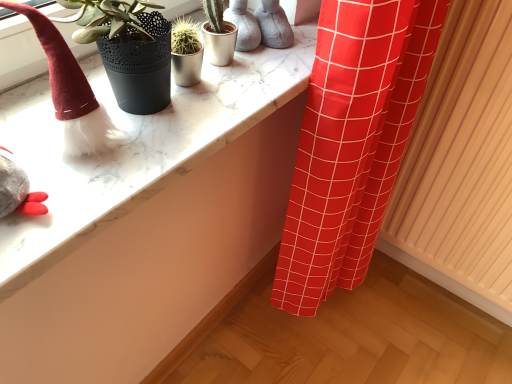
I want to click on vacant region in front of fuzzy red hat at left, so click(x=53, y=185).